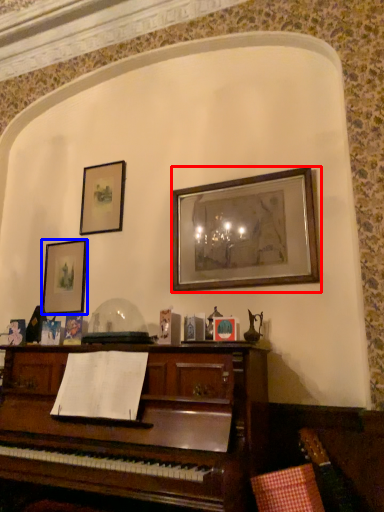
Question: Which object is further to the camera taking this photo, picture frame (highlighted by a red box) or picture frame (highlighted by a blue box)?

Choices:
 (A) picture frame
 (B) picture frame

Answer: (B)